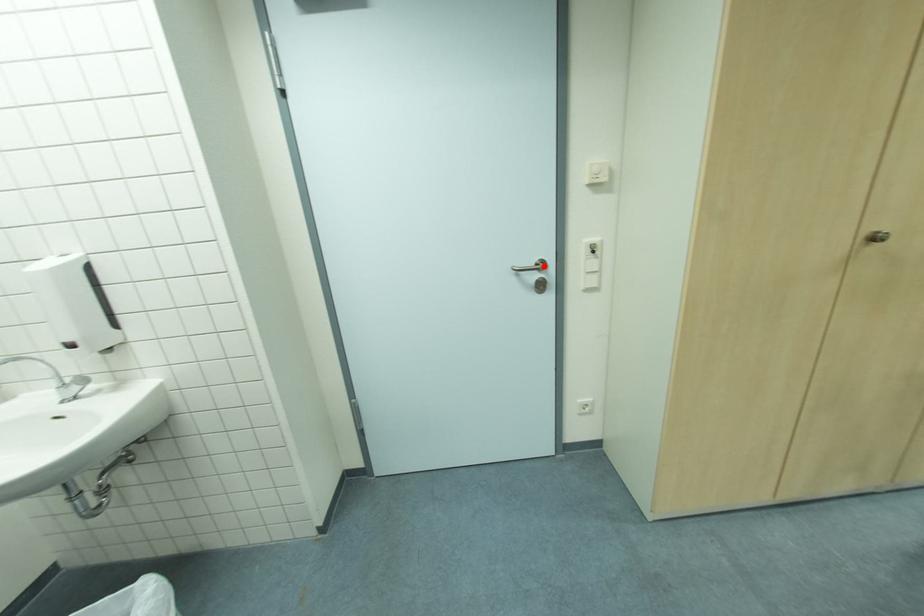
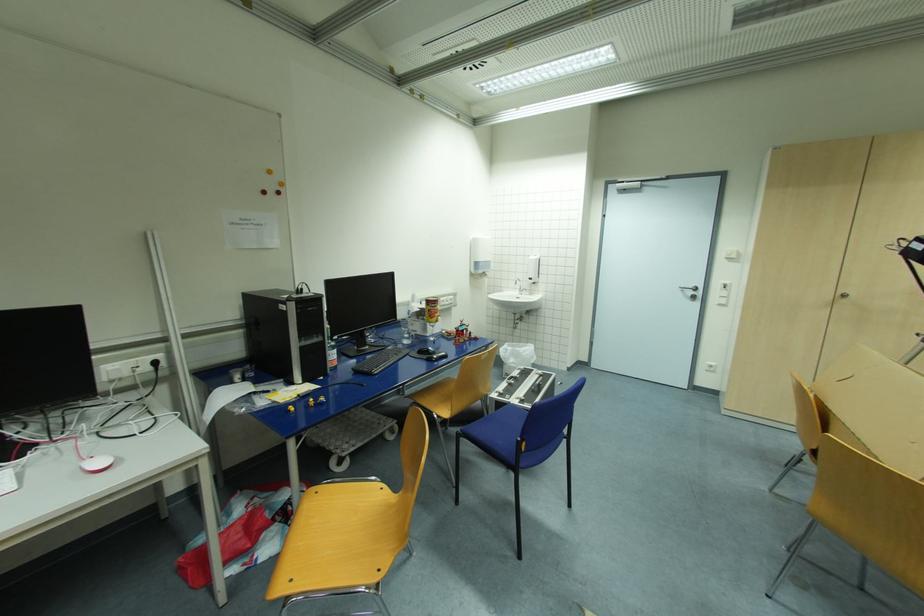
In the second image, find the point that corresponds to the highlighted location in the first image.

(699, 289)